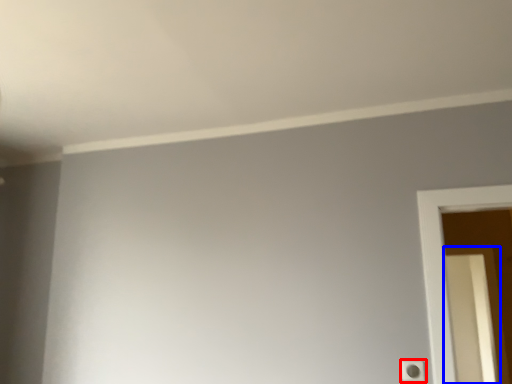
Question: Which of the following is the farthest to the observer, light switch (highlighted by a red box) or screen door (highlighted by a blue box)?

Choices:
 (A) light switch
 (B) screen door

Answer: (B)